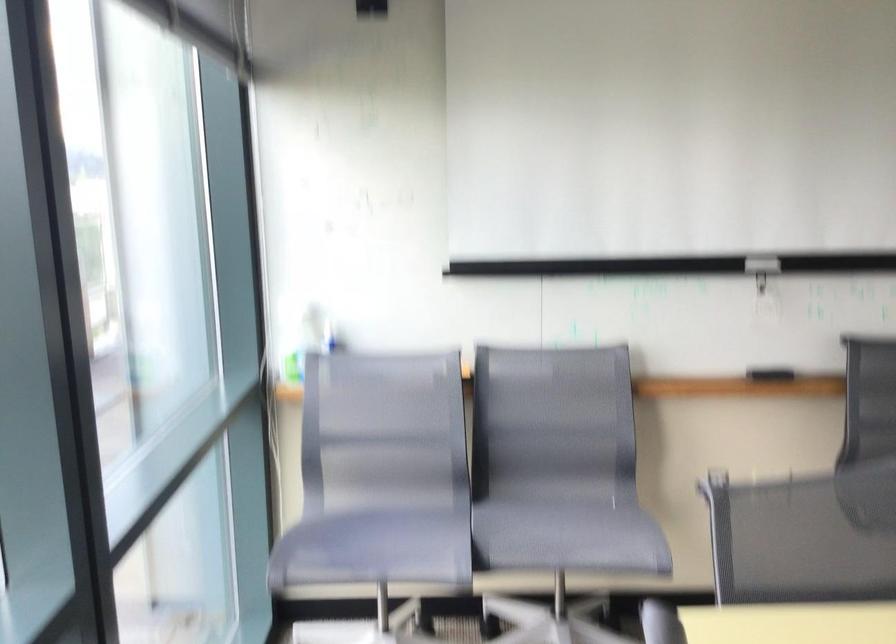
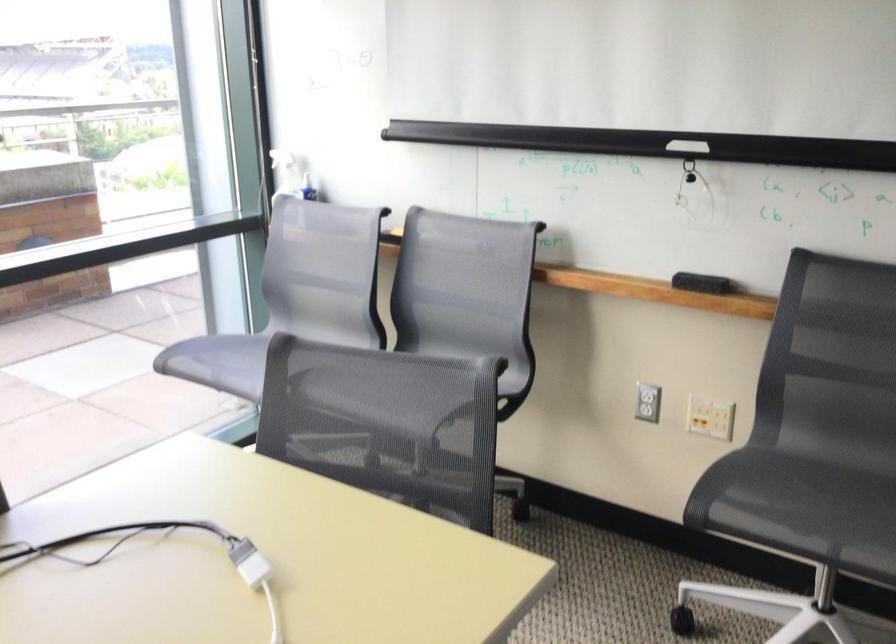
The point at (768,265) is marked in the first image. Where is the corresponding point in the second image?

(687, 146)